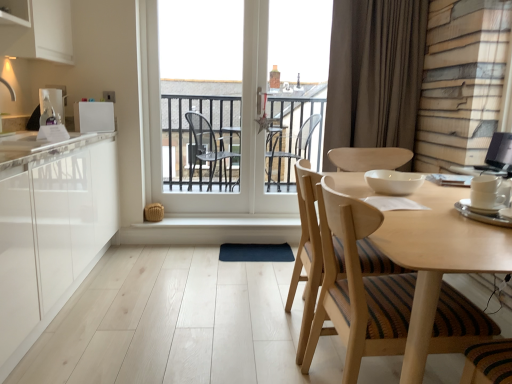
Question: From a real-world perspective, is white glossy countertop at left on top of wooden chair with striped cushion at center?

Choices:
 (A) yes
 (B) no

Answer: (A)

Question: Does white glossy countertop at left lie in front of wooden chair with striped cushion at center?

Choices:
 (A) yes
 (B) no

Answer: (B)

Question: Considering the relative sizes of white glossy countertop at left and wooden chair with striped cushion at center in the image provided, is white glossy countertop at left wider than wooden chair with striped cushion at center?

Choices:
 (A) no
 (B) yes

Answer: (B)

Question: Could you tell me if white glossy countertop at left is turned towards wooden chair with striped cushion at center?

Choices:
 (A) yes
 (B) no

Answer: (B)

Question: Is white glossy countertop at left next to wooden chair with striped cushion at center and touching it?

Choices:
 (A) yes
 (B) no

Answer: (B)

Question: Is white glossy countertop at left thinner than wooden chair with striped cushion at center?

Choices:
 (A) no
 (B) yes

Answer: (A)

Question: Is white glossy countertop at left wider than white glossy bowl at center, the 4th appliance in the back-to-front sequence?

Choices:
 (A) no
 (B) yes

Answer: (B)

Question: Is white glossy countertop at left further to the viewer compared to white glossy bowl at center, placed as the 3th appliance when sorted from right to left?

Choices:
 (A) yes
 (B) no

Answer: (A)

Question: Considering the relative positions of white glossy countertop at left and white glossy bowl at center, the 4th appliance in the back-to-front sequence, in the image provided, is white glossy countertop at left to the left of white glossy bowl at center, the 4th appliance in the back-to-front sequence, from the viewer's perspective?

Choices:
 (A) no
 (B) yes

Answer: (B)

Question: Considering the relative sizes of white glossy countertop at left and white glossy bowl at center, the 4th appliance in the back-to-front sequence, in the image provided, is white glossy countertop at left smaller than white glossy bowl at center, the 4th appliance in the back-to-front sequence,?

Choices:
 (A) yes
 (B) no

Answer: (B)

Question: From a real-world perspective, is white glossy countertop at left positioned under white glossy bowl at center, placed as the 3th appliance when sorted from right to left, based on gravity?

Choices:
 (A) no
 (B) yes

Answer: (A)

Question: Can you confirm if white glossy countertop at left is positioned to the right of white glossy bowl at center, the 3th appliance from the left?

Choices:
 (A) no
 (B) yes

Answer: (A)

Question: Can we say white glossy countertop at left lies outside white glossy refrigerator at upper left, the second appliance viewed from the back?

Choices:
 (A) no
 (B) yes

Answer: (B)